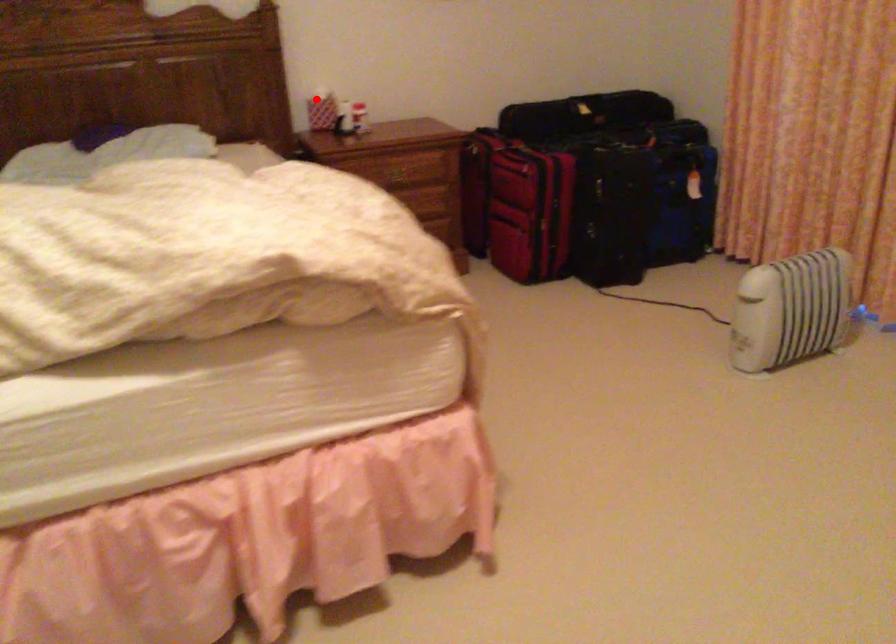
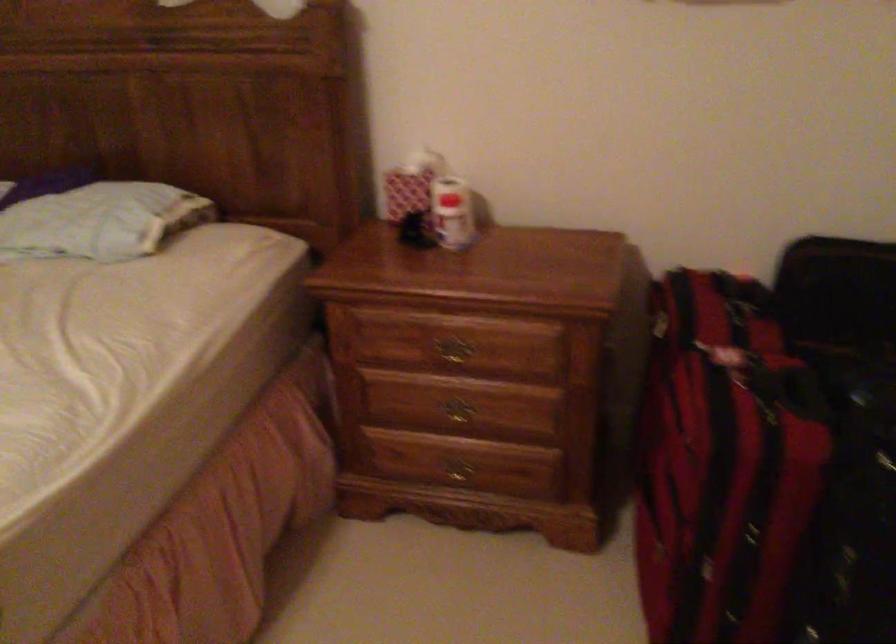
Where in the second image is the point corresponding to the highlighted location from the first image?

(410, 184)